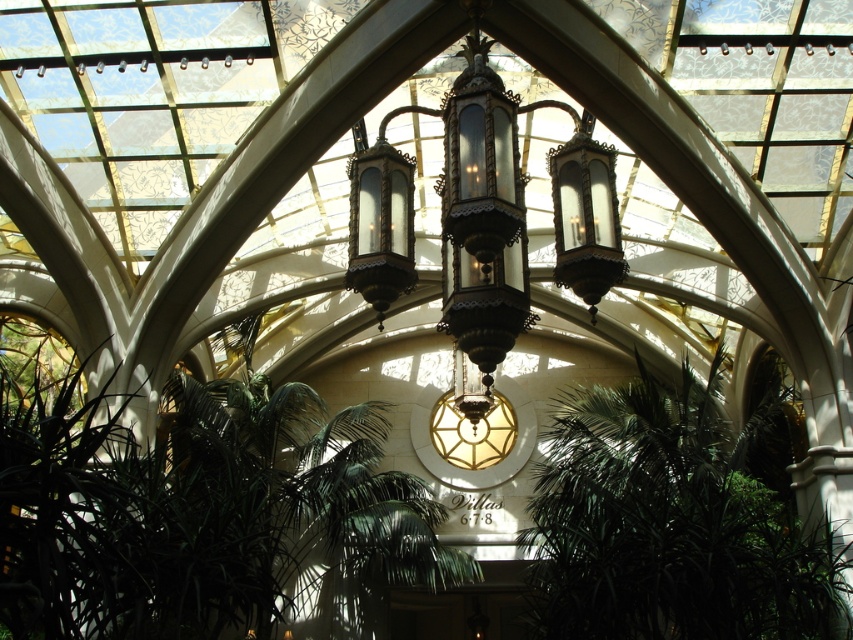
You are a maintenance worker needing to inspect both the green leafy palm tree at center and the polished brass chandelier at center in the atrium. You have a ladder that can extend up to 15 meters. Can you safely reach both objects with your current ladder?

The distance between the green leafy palm tree at center and the polished brass chandelier at center is 16.65 meters. Since your ladder only extends to 15 meters, you cannot safely reach both objects with your current ladder.

In the scene shown: You are planning to place a new sculpture in the atrium. The sculpture requires a space wider than the polished brass chandelier at center. Can the green leafy palm tree at center provide enough space for the sculpture?

The green leafy palm tree at center is wider than the polished brass chandelier at center, so it can provide enough space for the sculpture that requires a width larger than the chandelier.